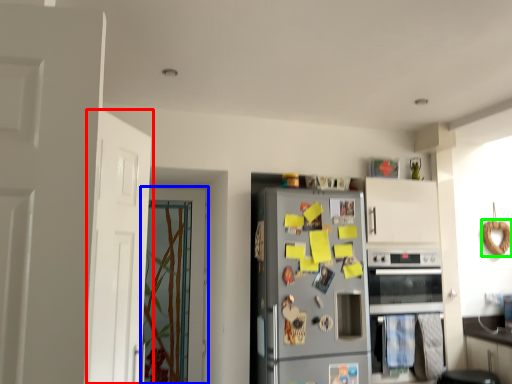
Question: Based on their relative distances, which object is farther from door (highlighted by a red box)? Choose from door (highlighted by a blue box) and bagel (highlighted by a green box).

Choices:
 (A) door
 (B) bagel

Answer: (B)